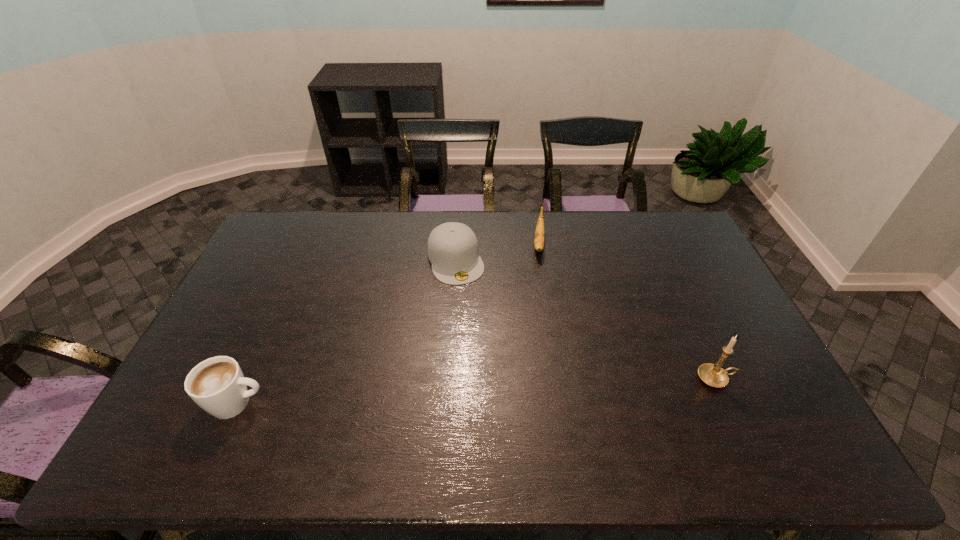
I want to click on cappuccino, so pyautogui.click(x=217, y=385).

Find the location of a particular element. The image size is (960, 540). the rightmost object is located at coordinates (713, 375).

Identify the location of the tallest object. Image resolution: width=960 pixels, height=540 pixels. (713, 375).

Locate an element on the screen. This screenshot has height=540, width=960. banana is located at coordinates point(539,233).

The image size is (960, 540). In order to click on the second object from left to right in this screenshot , I will do `click(453, 251)`.

In order to click on free space located 0.050m with the handle on the side of the leftmost object in this screenshot , I will do `click(287, 403)`.

Find the location of a particular element. This screenshot has height=540, width=960. free spot located 0.090m on the handle side of the candle holder is located at coordinates (767, 379).

In order to click on vacant region located on the peel of the banana from the top in this screenshot , I will do click(x=539, y=295).

This screenshot has height=540, width=960. Identify the location of free spot located 0.320m on the peel of the banana from the top. (538, 330).

The height and width of the screenshot is (540, 960). Find the location of `vacant position located 0.130m on the peel of the banana from the top`. vacant position located 0.130m on the peel of the banana from the top is located at coordinates (540, 287).